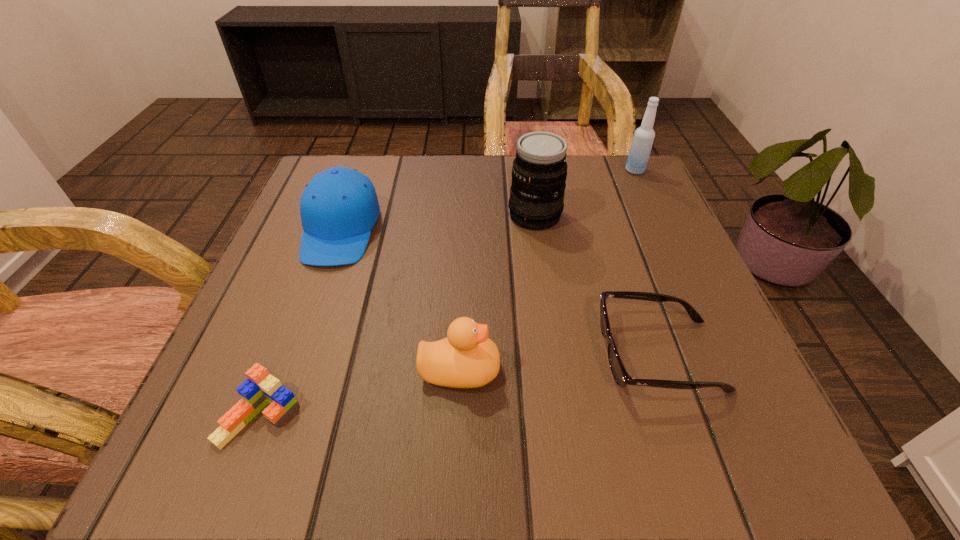
Find the location of a particular element. Image resolution: width=960 pixels, height=540 pixels. free space located on the lenses of the spectacles is located at coordinates (415, 355).

Identify the location of blank space located 0.220m on the lenses of the spectacles. (454, 355).

Find the location of `vacant space located 0.120m on the lenses of the spectacles`. vacant space located 0.120m on the lenses of the spectacles is located at coordinates (520, 355).

This screenshot has width=960, height=540. What are the coordinates of `vacant space located 0.240m on the back of the Lego` in the screenshot? It's located at (315, 269).

Find the location of a particular element. The width and height of the screenshot is (960, 540). bottle that is at the far edge is located at coordinates (642, 142).

What are the coordinates of `telephoto lens located at the far edge` in the screenshot? It's located at (539, 172).

Identify the location of cap at the far edge. This screenshot has height=540, width=960. (339, 207).

Locate an element on the screen. This screenshot has height=540, width=960. object that is positioned at the near edge is located at coordinates (261, 388).

Identify the location of cap that is at the left edge. The width and height of the screenshot is (960, 540). (339, 207).

Where is `Lego that is at the left edge`? Lego that is at the left edge is located at coordinates (261, 388).